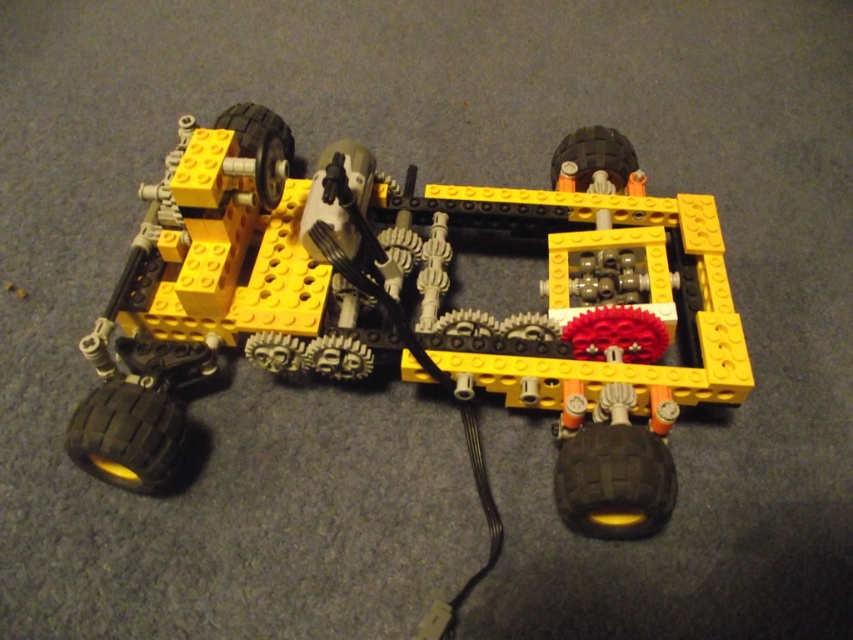
Is point (236, 132) in front of point (618, 138)?

Yes, point (236, 132) is closer to viewer.

Does black rubber tire at upper center appear on the left side of black rubber tire at upper right?

Yes, black rubber tire at upper center is to the left of black rubber tire at upper right.

Is point (248, 104) more distant than point (625, 136)?

No, it is in front of (625, 136).

You are a GUI agent. You are given a task and a screenshot of the screen. Output one action in this format:
    pyautogui.click(x=<x>, y=<y>)
    Task: Click on the black rubber tire at upper center
    Image resolution: width=853 pixels, height=640 pixels.
    Given the screenshot: What is the action you would take?
    pyautogui.click(x=259, y=148)

Which is above, yellow plastic car at center or black rubber tire at lower left?

yellow plastic car at center is higher up.

Who is positioned more to the right, yellow plastic car at center or black rubber tire at lower left?

yellow plastic car at center is more to the right.

Measure the distance between yellow plastic car at center and camera.

yellow plastic car at center is 3.43 feet away from camera.

This screenshot has height=640, width=853. What are the coordinates of `yellow plastic car at center` in the screenshot? It's located at (426, 288).

Does black rubber tire at lower right appear on the right side of black rubber tire at lower left?

Indeed, black rubber tire at lower right is positioned on the right side of black rubber tire at lower left.

Is point (657, 513) behind point (107, 445)?

No, (657, 513) is closer to viewer.

Find the location of a particular element. The image size is (853, 640). black rubber tire at lower right is located at coordinates [614, 481].